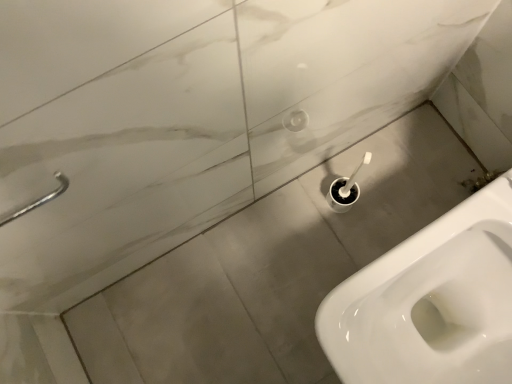
Locate an element on the screen. This screenshot has height=384, width=512. white glossy sink at center is located at coordinates (430, 302).

What do you see at coordinates (430, 302) in the screenshot?
I see `white glossy sink at center` at bounding box center [430, 302].

Where is `white glossy sink at center`? white glossy sink at center is located at coordinates (430, 302).